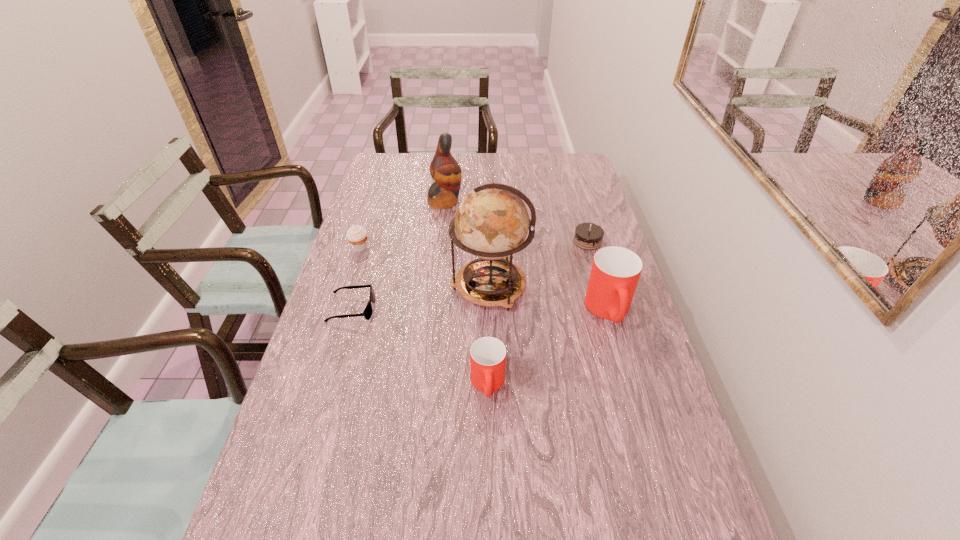
In the current image, all cups are evenly spaced. To maintain this equal spacing, where should an additional cup be placed on the left? Please point out a free spot. Please provide its 2D coordinates. Your answer should be formatted as a tuple, i.e. [(x, y)], where the tuple contains the x and y coordinates of a point satisfying the conditions above.

[(319, 487)]